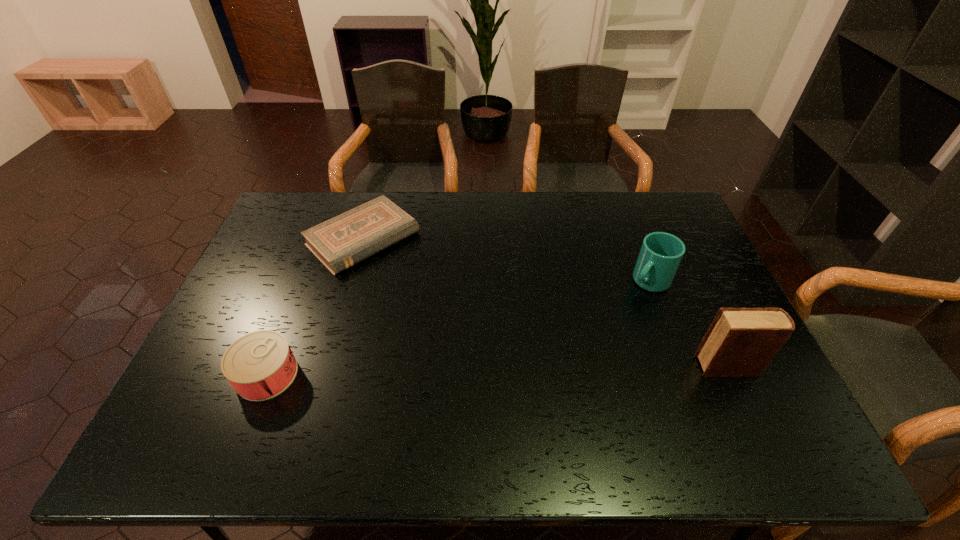
Locate an element on the screen. This screenshot has width=960, height=540. blank space at the left edge is located at coordinates (273, 277).

The width and height of the screenshot is (960, 540). In order to click on vacant area at the right edge in this screenshot , I will do `click(687, 260)`.

At what (x,y) coordinates should I click in order to perform the action: click on free region at the far left corner. Please return your answer as a coordinate pair (x, y). Looking at the image, I should click on (312, 224).

In the image, there is a desktop. Where is `vacant region at the far right corner`? The width and height of the screenshot is (960, 540). vacant region at the far right corner is located at coordinates pos(655,201).

At what (x,y) coordinates should I click in order to perform the action: click on empty location between the shortest object and the diary. Please return your answer as a coordinate pair (x, y). This screenshot has width=960, height=540. Looking at the image, I should click on (545, 302).

Locate an element on the screen. Image resolution: width=960 pixels, height=540 pixels. empty space between the cup and the can is located at coordinates (458, 328).

This screenshot has width=960, height=540. Find the location of `free space between the can and the tallest object`. free space between the can and the tallest object is located at coordinates (497, 370).

Where is `vacant space in between the Bible and the second tallest object`? The height and width of the screenshot is (540, 960). vacant space in between the Bible and the second tallest object is located at coordinates (506, 260).

The width and height of the screenshot is (960, 540). What are the coordinates of `free point between the third shortest object and the diary` in the screenshot? It's located at (688, 323).

I want to click on free space between the second shortest object and the shortest object, so click(x=315, y=307).